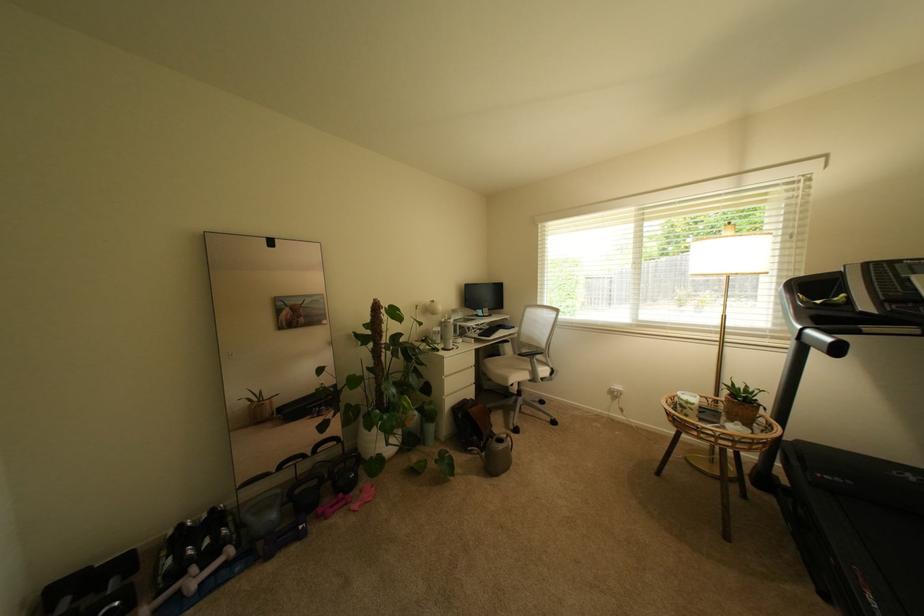
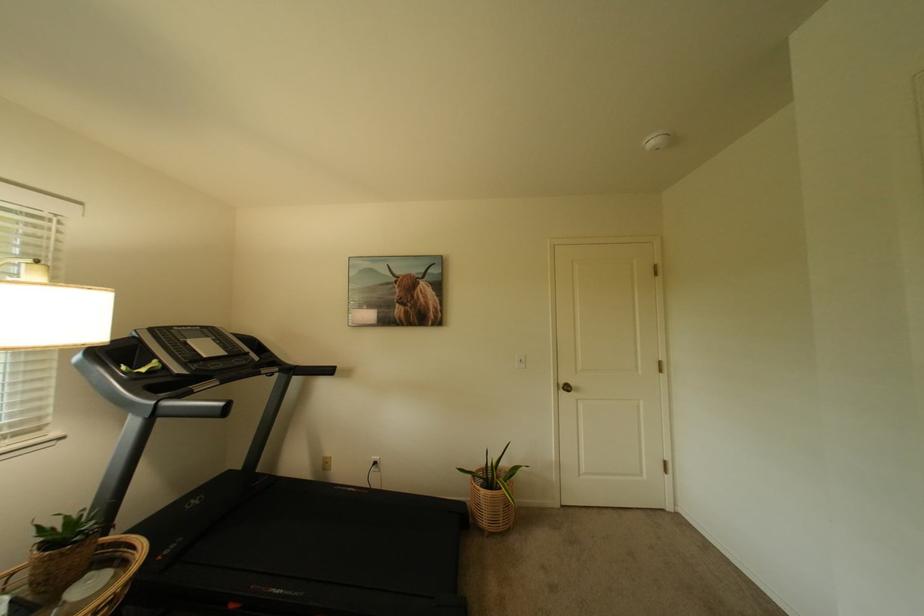
Locate, in the second image, the point that corresponds to pixel 733 428 in the first image.

(73, 605)